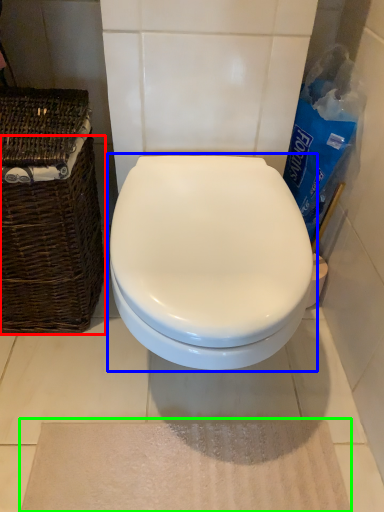
Question: Estimate the real-world distances between objects in this image. Which object is farther from basket (highlighted by a red box), toilet (highlighted by a blue box) or bath mat (highlighted by a green box)?

Choices:
 (A) toilet
 (B) bath mat

Answer: (B)